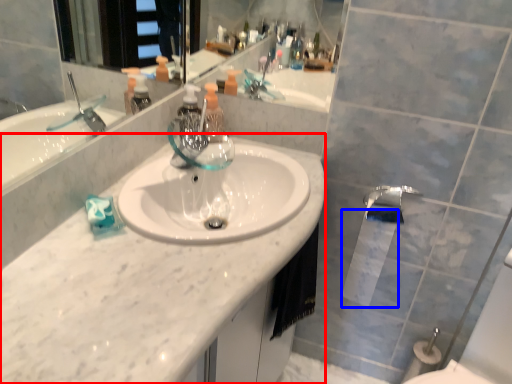
Question: Which object appears farthest to the camera in this image, counter top (highlighted by a red box) or toilet paper (highlighted by a blue box)?

Choices:
 (A) counter top
 (B) toilet paper

Answer: (B)